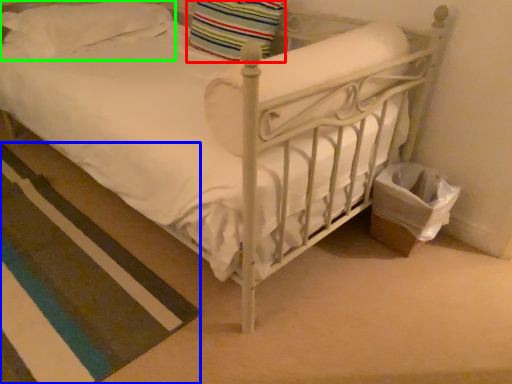
Question: Which object is positioned farthest from pillow (highlighted by a red box)? Select from strip (highlighted by a blue box) and pillow (highlighted by a green box).

Choices:
 (A) strip
 (B) pillow

Answer: (A)